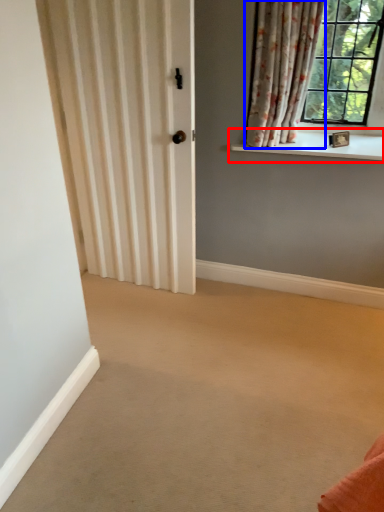
Question: Which of the following is the farthest to the observer, window sill (highlighted by a red box) or curtain (highlighted by a blue box)?

Choices:
 (A) window sill
 (B) curtain

Answer: (A)